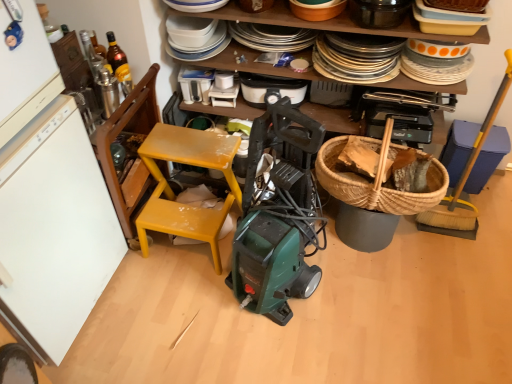
I want to click on free space above black plastic vacuum cleaner at center, placed as the fourth appliance when sorted from left to right (from a real-world perspective), so click(271, 85).